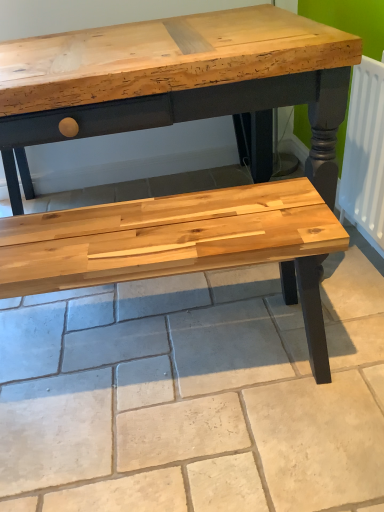
The width and height of the screenshot is (384, 512). I want to click on free location above natural wood bench at center (from a real-world perspective), so click(x=159, y=343).